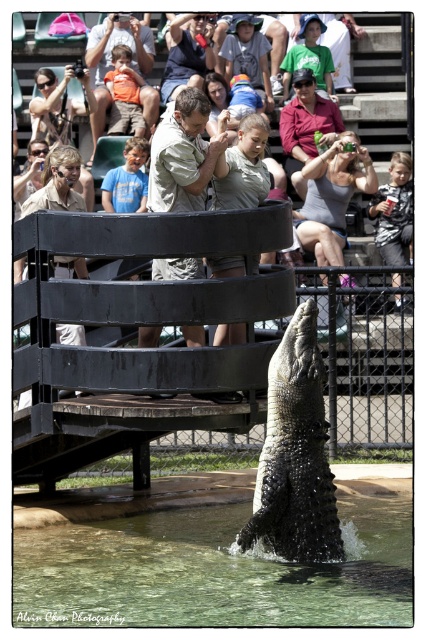
Question: Which object is the farthest from the matte khaki shirt at upper left?

Choices:
 (A) light brown textured shirt at center
 (B) shiny black crocodile at center
 (C) khaki cotton shirt at upper center

Answer: (B)

Question: Can you confirm if matte khaki shirt at upper left is thinner than light brown leather jacket at upper center?

Choices:
 (A) no
 (B) yes

Answer: (A)

Question: Which object is the closest to the matte khaki shirt at upper left?

Choices:
 (A) clear water at lower center
 (B) light brown textured shirt at center

Answer: (B)

Question: Which point appears farthest from the camera in this image?

Choices:
 (A) (x=154, y=90)
 (B) (x=264, y=99)

Answer: (A)

Question: Is shiny black crocodile at center in front of matte khaki shirt at upper left?

Choices:
 (A) no
 (B) yes

Answer: (B)

Question: Does light brown textured shirt at center appear over khaki cotton shirt at upper center?

Choices:
 (A) no
 (B) yes

Answer: (A)